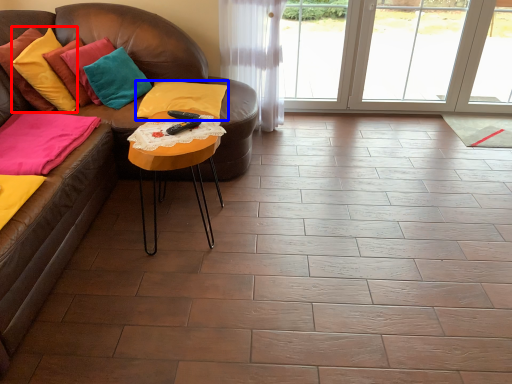
Question: Which object appears farthest to the camera in this image, pillow (highlighted by a red box) or pillow (highlighted by a blue box)?

Choices:
 (A) pillow
 (B) pillow

Answer: (B)